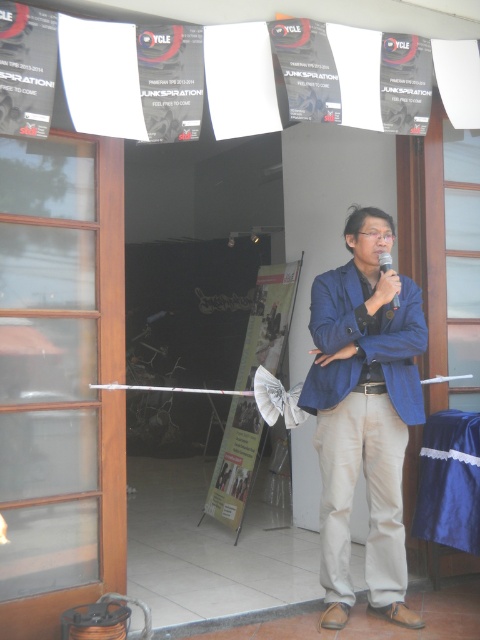
Question: Which point appears farthest from the camera in this image?

Choices:
 (A) (344, 284)
 (B) (232, 461)

Answer: (B)

Question: Among these objects, which one is farthest from the camera?

Choices:
 (A) white fabric poster at center
 (B) black plastic microphone at center

Answer: (A)

Question: Is blue fabric jacket at center smaller than matte blue jacket at center?

Choices:
 (A) no
 (B) yes

Answer: (A)

Question: Is clear glass door at left positioned in front of matte blue jacket at center?

Choices:
 (A) no
 (B) yes

Answer: (B)

Question: Among these objects, which one is farthest from the camera?

Choices:
 (A) matte blue jacket at center
 (B) clear glass door at left
 (C) white fabric poster at center
 (D) khaki pants at center

Answer: (C)

Question: Does blue fabric jacket at center lie in front of black plastic microphone at center?

Choices:
 (A) no
 (B) yes

Answer: (B)